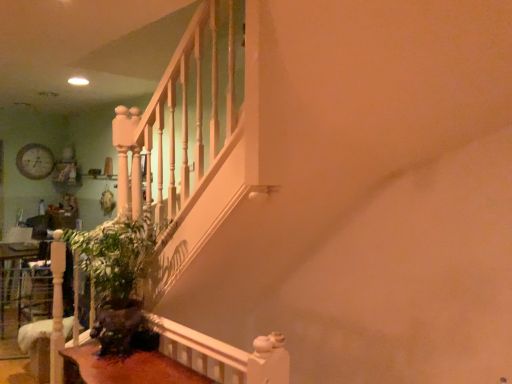
Question: From the image's perspective, is wooden clock at upper left under brown wooden table at lower left?

Choices:
 (A) yes
 (B) no

Answer: (B)

Question: Considering the relative sizes of wooden clock at upper left and brown wooden table at lower left in the image provided, is wooden clock at upper left wider than brown wooden table at lower left?

Choices:
 (A) yes
 (B) no

Answer: (B)

Question: Is wooden clock at upper left to the left of brown wooden table at lower left from the viewer's perspective?

Choices:
 (A) no
 (B) yes

Answer: (B)

Question: Is wooden clock at upper left bigger than brown wooden table at lower left?

Choices:
 (A) no
 (B) yes

Answer: (A)

Question: Does wooden clock at upper left have a lesser height compared to brown wooden table at lower left?

Choices:
 (A) yes
 (B) no

Answer: (B)

Question: From the image's perspective, is green matte plant at lower left above or below wooden clock at upper left?

Choices:
 (A) above
 (B) below

Answer: (B)

Question: Is point (115, 349) positioned closer to the camera than point (29, 147)?

Choices:
 (A) farther
 (B) closer

Answer: (B)

Question: Considering their positions, is green matte plant at lower left located in front of or behind wooden clock at upper left?

Choices:
 (A) front
 (B) behind

Answer: (A)

Question: From a real-world perspective, is green matte plant at lower left physically located above or below wooden clock at upper left?

Choices:
 (A) above
 (B) below

Answer: (B)

Question: From a real-world perspective, is green matte plant at lower left positioned above or below brown wooden table at lower left?

Choices:
 (A) below
 (B) above

Answer: (B)

Question: Choose the correct answer: Is green matte plant at lower left inside brown wooden table at lower left or outside it?

Choices:
 (A) outside
 (B) inside

Answer: (A)

Question: Is point (128, 261) closer or farther from the camera than point (88, 354)?

Choices:
 (A) farther
 (B) closer

Answer: (A)

Question: From the image's perspective, relative to brown wooden table at lower left, is green matte plant at lower left above or below?

Choices:
 (A) below
 (B) above

Answer: (B)

Question: Is point click(28, 160) closer or farther from the camera than point click(154, 236)?

Choices:
 (A) closer
 (B) farther

Answer: (B)

Question: From a real-world perspective, is wooden clock at upper left above or below green matte plant at lower left?

Choices:
 (A) below
 (B) above

Answer: (B)